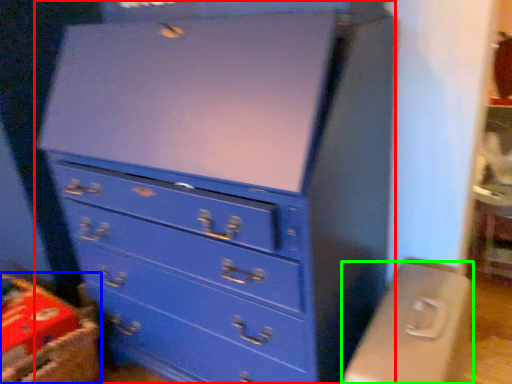
Question: Which is nearer to the chest of drawers (highlighted by a red box)? crate (highlighted by a blue box) or computer desk (highlighted by a green box).

Choices:
 (A) crate
 (B) computer desk

Answer: (B)